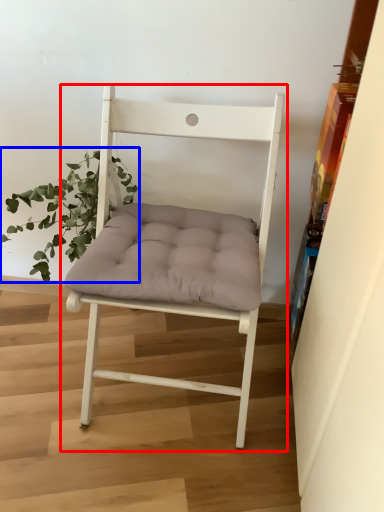
Question: Which point is closer to the camera, chair (highlighted by a red box) or houseplant (highlighted by a blue box)?

Choices:
 (A) chair
 (B) houseplant

Answer: (A)